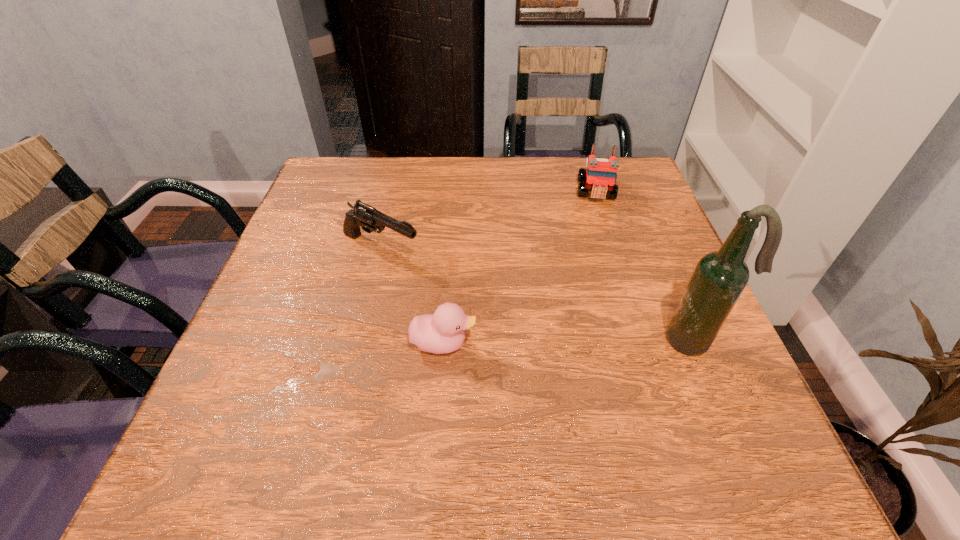
Locate an element on the screen. duckling is located at coordinates (442, 332).

Identify the location of beer bottle. Image resolution: width=960 pixels, height=540 pixels. (719, 278).

Find the location of a particular element. This screenshot has width=960, height=540. the third nearest object is located at coordinates (369, 218).

At what (x,y) coordinates should I click in order to perform the action: click on Lego. Please return your answer as a coordinate pair (x, y). The image size is (960, 540). Looking at the image, I should click on (599, 177).

This screenshot has height=540, width=960. Find the location of `blank area located 0.120m on the front-facing side of the duckling`. blank area located 0.120m on the front-facing side of the duckling is located at coordinates (540, 343).

What are the coordinates of `vacant space located 0.280m on the back of the beer bottle` in the screenshot? It's located at (650, 234).

Where is `free space located 0.380m at the end of the barrel of the gun`? The width and height of the screenshot is (960, 540). free space located 0.380m at the end of the barrel of the gun is located at coordinates (564, 339).

Image resolution: width=960 pixels, height=540 pixels. I want to click on vacant space located 0.120m at the end of the barrel of the gun, so click(456, 283).

In order to click on blank space located at the end of the barrel of the gun in this screenshot , I will do `click(468, 289)`.

You are a GUI agent. You are given a task and a screenshot of the screen. Output one action in this format:
    pyautogui.click(x=<x>, y=<y>)
    Task: Click on the free space located 0.350m on the front-facing side of the Lego
    
    Given the screenshot: What is the action you would take?
    pyautogui.click(x=602, y=305)